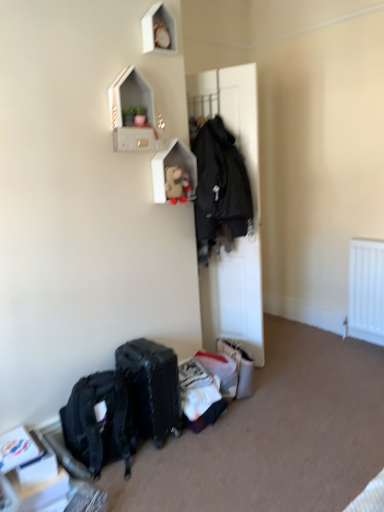
Question: From the image's perspective, is matte black suitcase at lower center beneath wooden shelf at upper center, marked as the second shelf in a front-to-back arrangement?

Choices:
 (A) yes
 (B) no

Answer: (A)

Question: Is matte black suitcase at lower center bigger than wooden shelf at upper center, arranged as the first shelf when viewed from the back?

Choices:
 (A) yes
 (B) no

Answer: (A)

Question: Is matte black suitcase at lower center positioned beyond the bounds of wooden shelf at upper center, arranged as the first shelf when viewed from the back?

Choices:
 (A) yes
 (B) no

Answer: (A)

Question: Is matte black suitcase at lower center far from wooden shelf at upper center, arranged as the first shelf when viewed from the back?

Choices:
 (A) yes
 (B) no

Answer: (A)

Question: Is matte black suitcase at lower center taller than wooden shelf at upper center, arranged as the first shelf when viewed from the back?

Choices:
 (A) yes
 (B) no

Answer: (A)

Question: Can you confirm if matte black suitcase at lower center is shorter than wooden shelf at upper center, marked as the second shelf in a front-to-back arrangement?

Choices:
 (A) no
 (B) yes

Answer: (A)

Question: Is matte black backpack at lower left oriented away from wooden shelf at upper center, arranged as the first shelf when viewed from the back?

Choices:
 (A) no
 (B) yes

Answer: (A)

Question: Is matte black backpack at lower left facing towards wooden shelf at upper center, arranged as the first shelf when viewed from the back?

Choices:
 (A) yes
 (B) no

Answer: (B)

Question: Does matte black backpack at lower left have a larger size compared to wooden shelf at upper center, arranged as the first shelf when viewed from the back?

Choices:
 (A) no
 (B) yes

Answer: (B)

Question: Considering the relative sizes of matte black backpack at lower left and wooden shelf at upper center, marked as the second shelf in a front-to-back arrangement, in the image provided, is matte black backpack at lower left wider than wooden shelf at upper center, marked as the second shelf in a front-to-back arrangement,?

Choices:
 (A) yes
 (B) no

Answer: (A)

Question: Considering the relative sizes of matte black backpack at lower left and wooden shelf at upper center, arranged as the first shelf when viewed from the back, in the image provided, is matte black backpack at lower left thinner than wooden shelf at upper center, arranged as the first shelf when viewed from the back,?

Choices:
 (A) yes
 (B) no

Answer: (B)

Question: Considering the relative sizes of matte black backpack at lower left and wooden shelf at upper center, arranged as the first shelf when viewed from the back, in the image provided, is matte black backpack at lower left shorter than wooden shelf at upper center, arranged as the first shelf when viewed from the back,?

Choices:
 (A) no
 (B) yes

Answer: (A)

Question: Can you confirm if black matte door at center is positioned to the right of matte black suitcase at lower center?

Choices:
 (A) no
 (B) yes

Answer: (B)